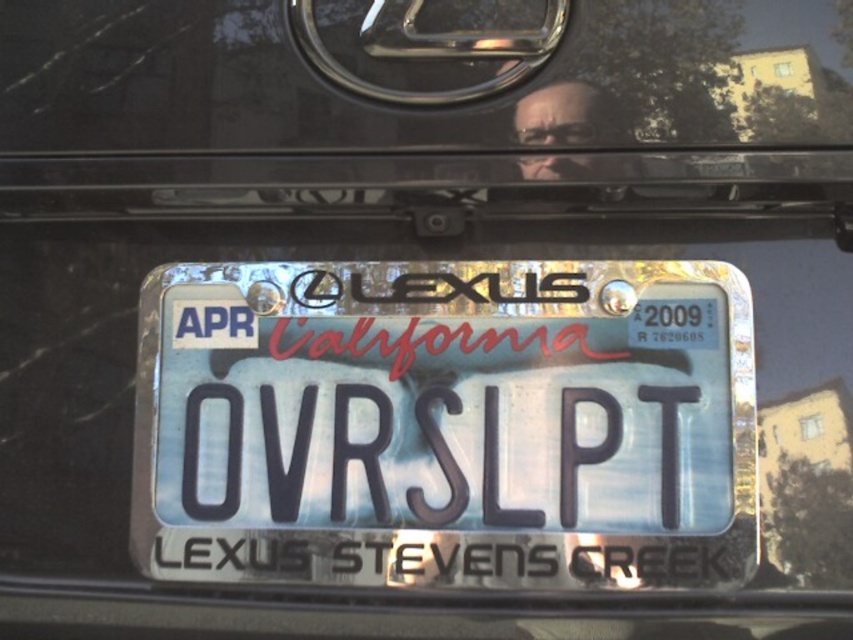
You are a driver looking at the rear of a black Lexus. You see the metallic reflective license plate at center and the transparent glass at center. Which object is closer to the right side of the vehicle?

The metallic reflective license plate at center is to the right of the transparent glass at center, so it is closer to the right side of the vehicle.

In the scene shown: What are the coordinates of the metallic reflective license plate at center?

The metallic reflective license plate at center is located at coordinates point (445, 424).